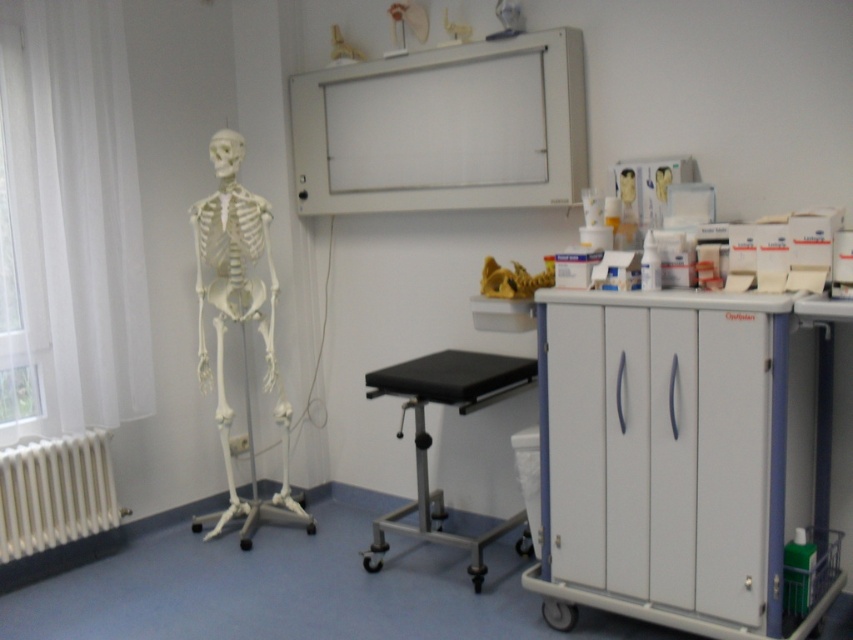
Based on the photo, you are a student who needs to sit on the black rubber stool at center to study the white plastic skeleton at left. Which direction should you move to reach the stool while facing the skeleton?

Since the white plastic skeleton at left is positioned on the left side of the black rubber stool at center, you should move to your right to reach the stool while facing the skeleton.

You are a student who needs to sit on the black rubber stool at center while keeping a distance of at least 1.5 meters from the white matte radiator at lower left for safety. Can you safely sit there?

The black rubber stool at center is only 1.33 meters away from the white matte radiator at lower left, which is less than the required 1.5 meters safety distance. Therefore, sitting there would not be safe.